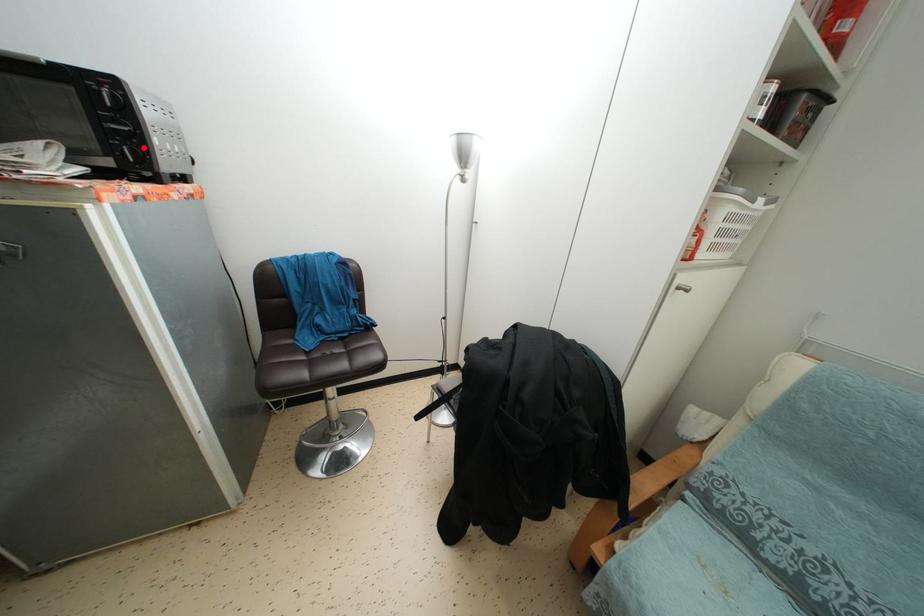
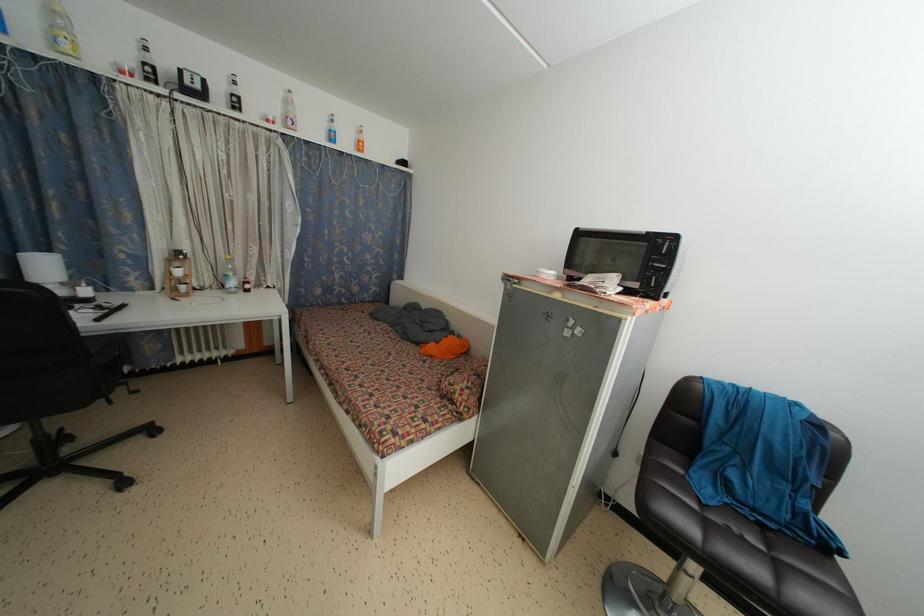
Where in the second image is the point corresponding to the highlighted location from the first image?

(669, 280)